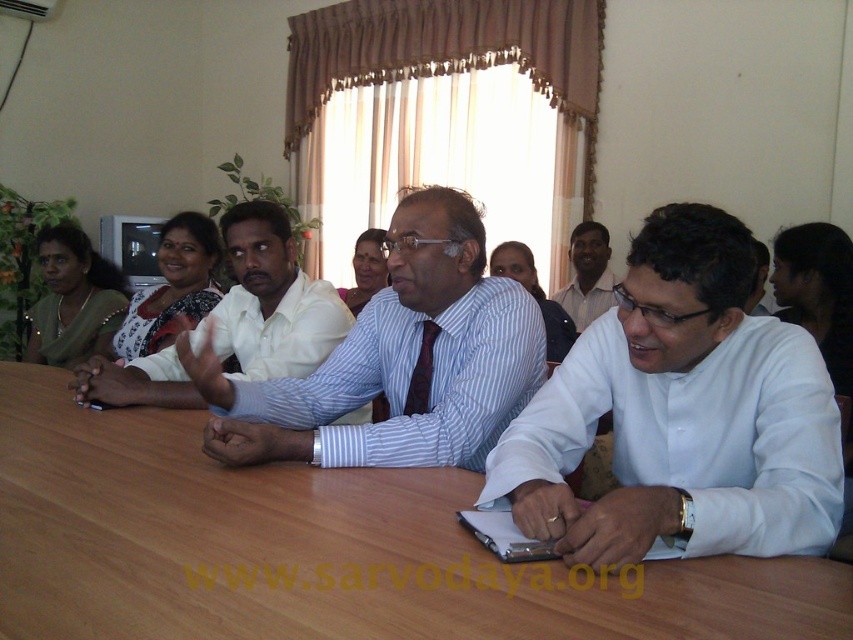
Question: Which object is the farthest from the striped cotton shirt at center?

Choices:
 (A) white shirt at center
 (B) brown wooden table at center
 (C) white matte shirt at center

Answer: (A)

Question: Does brown wooden table at center have a smaller size compared to white matte shirt at center?

Choices:
 (A) yes
 (B) no

Answer: (B)

Question: Which point appears farthest from the camera in this image?

Choices:
 (A) (611, 298)
 (B) (480, 385)
 (C) (55, 620)
 (D) (749, 522)

Answer: (A)

Question: In this image, where is white matte shirt at center located relative to blue striped shirt at center?

Choices:
 (A) right
 (B) left

Answer: (A)

Question: Which point appears farthest from the camera in this image?

Choices:
 (A) tap(134, 470)
 (B) tap(573, 237)
 (C) tap(259, 244)
 (D) tap(355, 404)

Answer: (B)

Question: Is brown wooden table at center positioned before blue striped shirt at center?

Choices:
 (A) yes
 (B) no

Answer: (A)